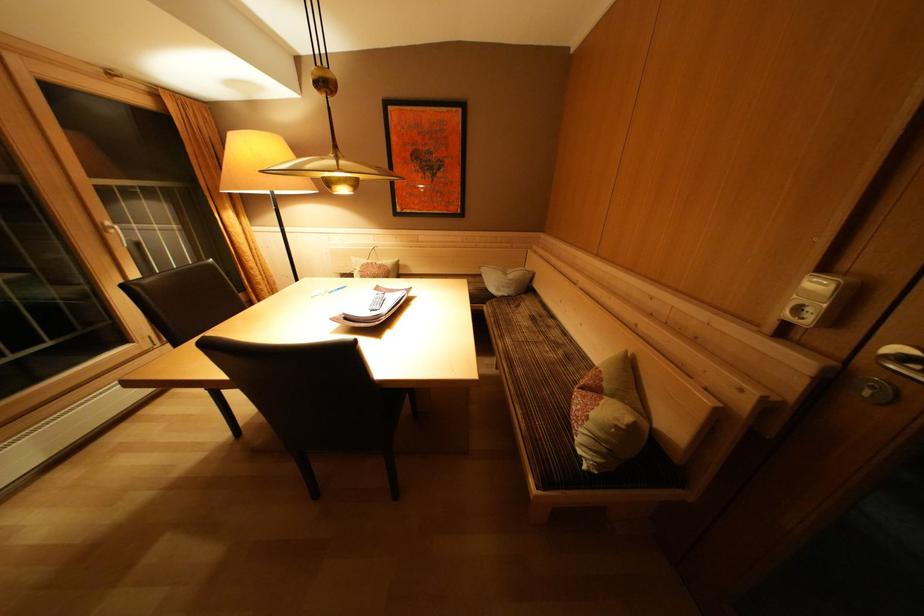
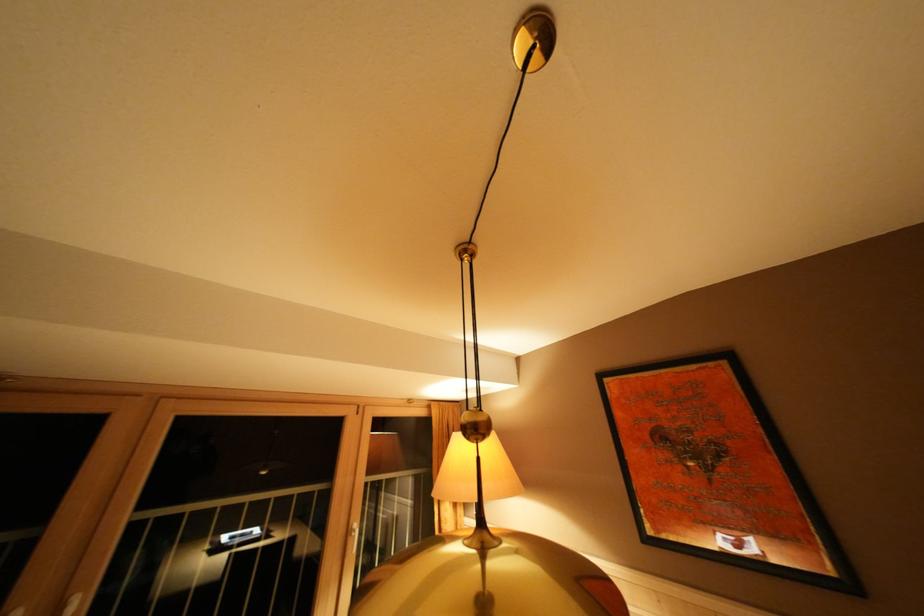
Find the pixel in the second image that matches [107,236] in the first image.

(355, 537)